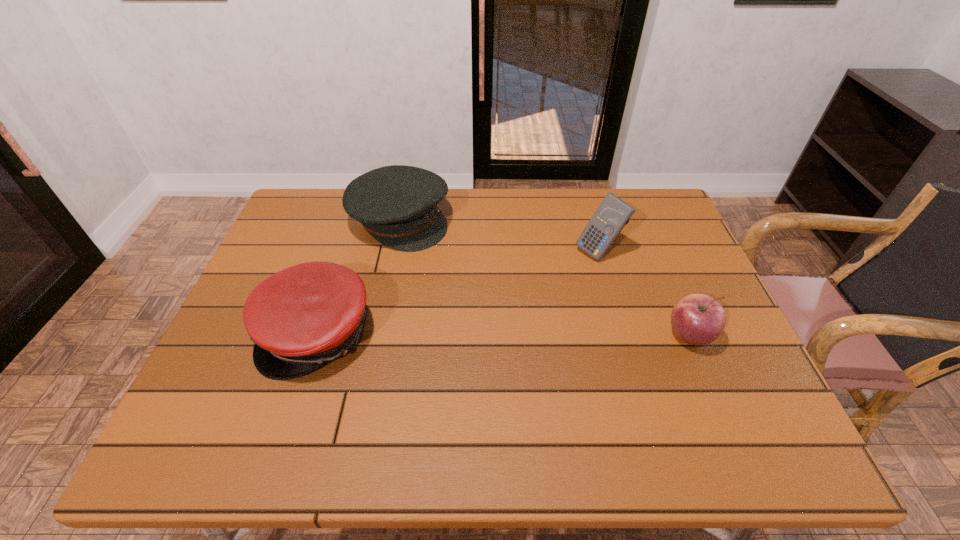
Identify the location of vacant space at the right edge. (678, 255).

In the image, there is a desktop. Identify the location of free space at the far left corner. (325, 199).

Locate an element on the screen. free area in between the rightmost object and the cap is located at coordinates click(504, 334).

Locate an element on the screen. The image size is (960, 540). free area in between the rightmost object and the cap is located at coordinates (504, 334).

Identify the location of free point between the apple and the beret. The height and width of the screenshot is (540, 960). (544, 278).

Where is `free point between the tallest object and the cap`? The height and width of the screenshot is (540, 960). free point between the tallest object and the cap is located at coordinates (458, 292).

Where is `free space between the cap and the tallest object`? The image size is (960, 540). free space between the cap and the tallest object is located at coordinates (458, 292).

The image size is (960, 540). I want to click on empty location between the calculator and the apple, so click(644, 293).

The height and width of the screenshot is (540, 960). Identify the location of vacant area between the rightmost object and the beret. (x=544, y=278).

You are a GUI agent. You are given a task and a screenshot of the screen. Output one action in this format:
    pyautogui.click(x=<x>, y=<y>)
    Task: Click on the object that is the second closest to the beret
    The image size is (960, 540).
    Given the screenshot: What is the action you would take?
    pyautogui.click(x=613, y=213)